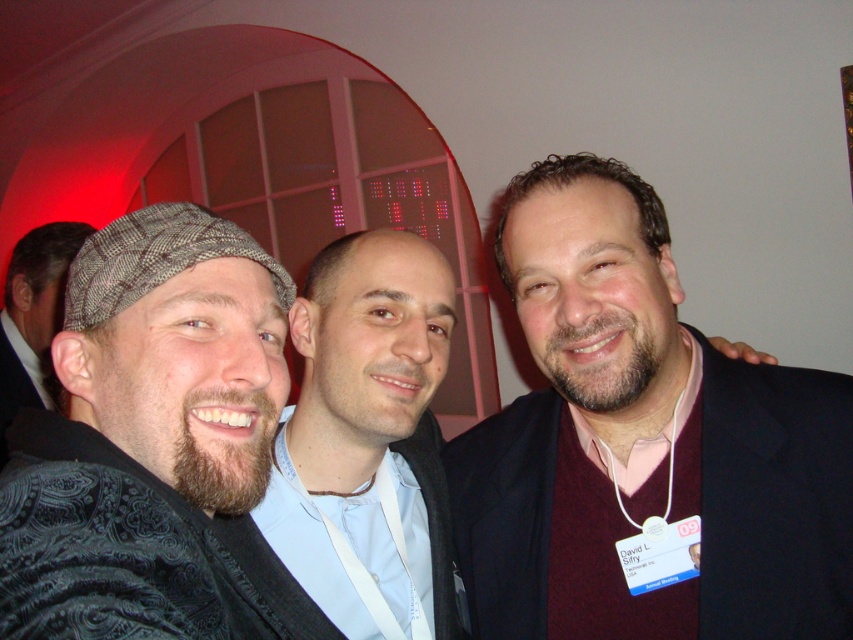
Question: Can you confirm if dark gray textured cap at left is positioned to the left of bearded man at center?

Choices:
 (A) no
 (B) yes

Answer: (B)

Question: Does maroon sweater at right appear on the left side of bearded man at center?

Choices:
 (A) yes
 (B) no

Answer: (B)

Question: Among these objects, which one is farthest from the camera?

Choices:
 (A) dark gray textured cap at left
 (B) bearded man with textured hat at left

Answer: (B)

Question: Among these objects, which one is nearest to the camera?

Choices:
 (A) bearded man with textured hat at left
 (B) bearded man at center

Answer: (B)

Question: Which of the following is the closest to the observer?

Choices:
 (A) (270, 532)
 (B) (44, 317)

Answer: (A)

Question: Can you confirm if maroon sweater at right is positioned to the left of dark gray textured cap at left?

Choices:
 (A) no
 (B) yes

Answer: (A)